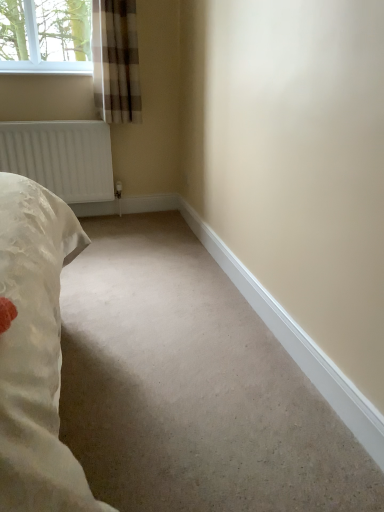
At what (x,y) coordinates should I click in order to perform the action: click on vacant space underneath plaid fabric curtain at upper left (from a real-world perspective). Please return your answer as a coordinate pair (x, y). The height and width of the screenshot is (512, 384). Looking at the image, I should click on (140, 216).